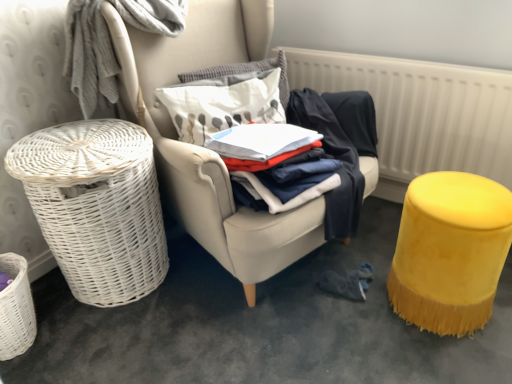
At what (x,y) coordinates should I click in order to perform the action: click on vacant space in front of white textured radiator at upper right. Please return your answer as a coordinate pair (x, y). The width and height of the screenshot is (512, 384). Looking at the image, I should click on (371, 285).